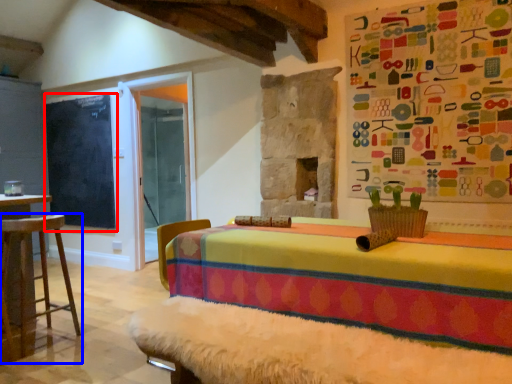
Question: Which object appears farthest to the camera in this image, bulletin board (highlighted by a red box) or furniture (highlighted by a blue box)?

Choices:
 (A) bulletin board
 (B) furniture

Answer: (A)